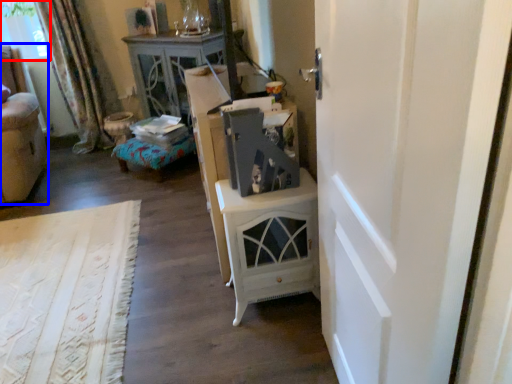
Question: Which object is closer to the camera taking this photo, window screen (highlighted by a red box) or furniture (highlighted by a blue box)?

Choices:
 (A) window screen
 (B) furniture

Answer: (B)